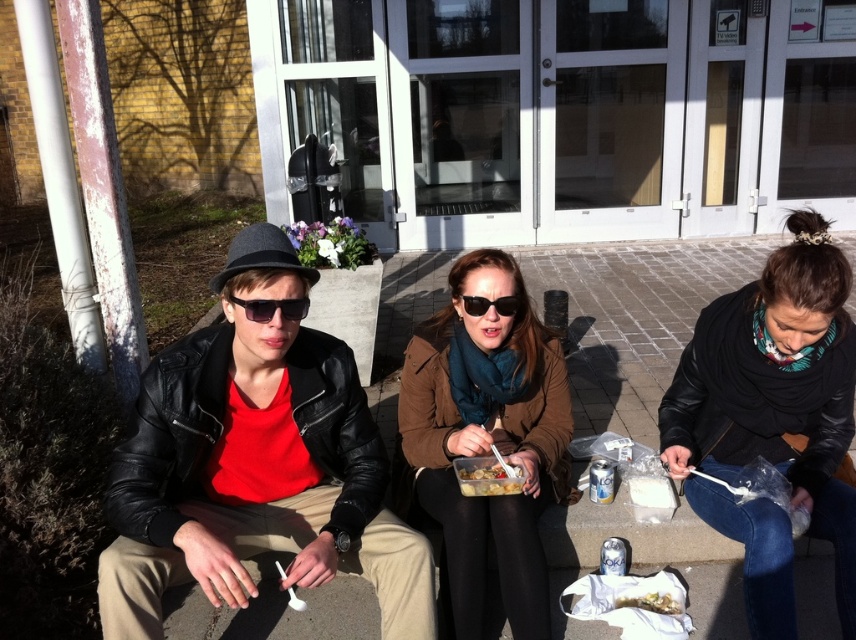
You are organizing a charity event and need to determine which item to prioritize packing first between the leather jacket at center and the black plastic sunglasses at center. Based on their sizes, which should be packed first?

The leather jacket at center is larger in size than the black plastic sunglasses at center, so you should pack the leather jacket at center first to ensure there is enough space for it later.